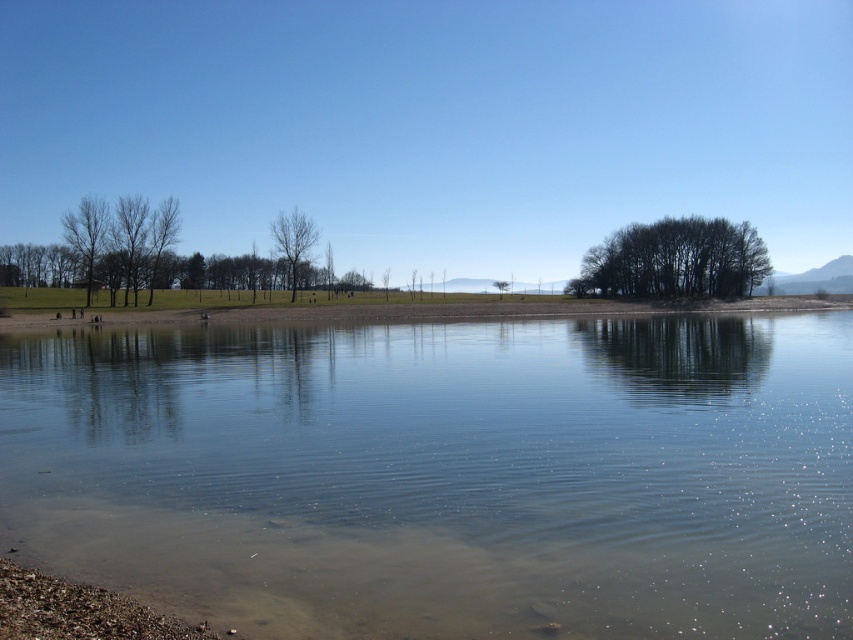
The height and width of the screenshot is (640, 853). Describe the element at coordinates (447, 474) in the screenshot. I see `clear water at center` at that location.

Does clear water at center have a greater height compared to bare branches at left?

No, clear water at center is not taller than bare branches at left.

Between point (616, 577) and point (96, 243), which one is positioned behind?

Point (96, 243)

In order to click on clear water at center in this screenshot , I will do `click(447, 474)`.

Does dark brown textured trees at center right have a greater height compared to bare branches at left?

No.

Who is higher up, dark brown textured trees at center right or bare branches at left?

Positioned higher is bare branches at left.

Is point (606, 259) in front of point (97, 227)?

No, it is not.

Locate an element on the screen. The height and width of the screenshot is (640, 853). dark brown textured trees at center right is located at coordinates (674, 260).

Can you confirm if clear water at center is positioned to the right of dark brown textured trees at center right?

In fact, clear water at center is to the left of dark brown textured trees at center right.

Is clear water at center taller than dark brown textured trees at center right?

Incorrect, clear water at center's height is not larger of dark brown textured trees at center right's.

The height and width of the screenshot is (640, 853). What are the coordinates of `clear water at center` in the screenshot? It's located at (447, 474).

The image size is (853, 640). In order to click on clear water at center in this screenshot , I will do `click(447, 474)`.